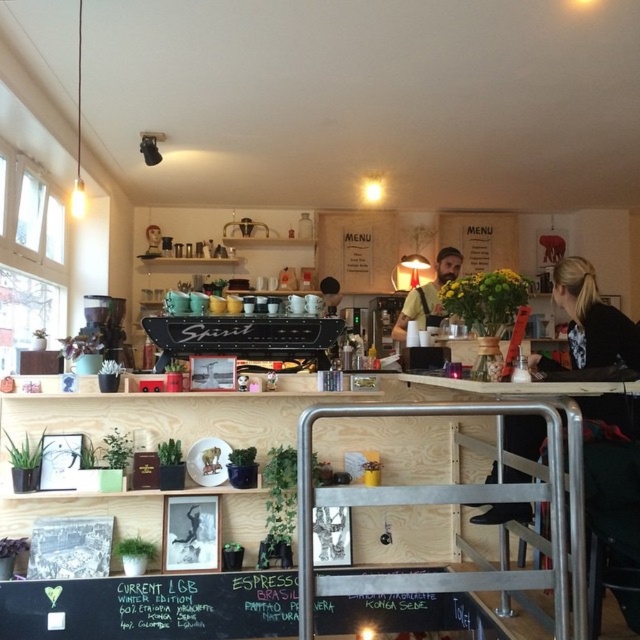
You are a customer in the cozy cafe and want to place an order. You notice two points marked on the counter. The first point is at coordinates point (x=208, y=621) and the second is at point (x=522, y=516). Which point is closer to you as you stand facing the counter?

Point (x=208, y=621) is closer to you because it is further to the viewer than point (x=522, y=516), meaning it is nearer when facing the counter.

You are a customer in the cozy cafe and want to write a message on the black chalkboard at lower center. However, you notice the black fabric jacket at upper right is hanging nearby. Can you fit the chalkboard message within the chalkboard without overlapping the jacket?

The black chalkboard at lower center is wider than the black fabric jacket at upper right, so yes, you can fit the message on the chalkboard without overlapping the jacket as it has enough space.

You are a customer sitting at a table near the large windows on the left side of the cozy cafe. You want to read the menu written on the black chalkboard at lower center. Can you see the chalkboard from your current position?

The black chalkboard at lower center is located at point (152, 605), which is near the counter area. Since you are sitting near the large windows on the left side, you might have an obstructed view of the chalkboard due to the counter or other items between you and the chalkboard. To see the menu clearly, you may need to move closer to the counter area or ask a staff member for assistance.